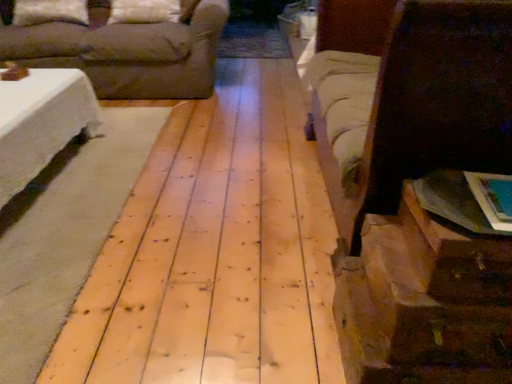
Question: Is white soft pillow at upper left, which is the 1th pillow from left to right, wider or thinner than white fabric pillow at upper center, the 2th pillow positioned from the left?

Choices:
 (A) thin
 (B) wide

Answer: (B)

Question: Based on their sizes in the image, would you say white soft pillow at upper left, which is the 1th pillow from left to right, is bigger or smaller than white fabric pillow at upper center, the 2th pillow positioned from the left?

Choices:
 (A) small
 (B) big

Answer: (B)

Question: Which of these objects is positioned closest to the brown fabric couch at upper left?

Choices:
 (A) white soft pillow at upper left, positioned as the 2th pillow in right-to-left order
 (B) white fabric pillow at upper center, arranged as the 1th pillow when viewed from the right
 (C) brown fabric bed at right
 (D) brown paper bag at lower right
 (E) natural wood floor at center

Answer: (B)

Question: Considering the real-world distances, which object is closest to the brown fabric bed at right?

Choices:
 (A) natural wood floor at center
 (B) white fabric pillow at upper center, arranged as the 1th pillow when viewed from the right
 (C) brown fabric couch at upper left
 (D) brown paper bag at lower right
 (E) white soft pillow at upper left, positioned as the 2th pillow in right-to-left order

Answer: (D)